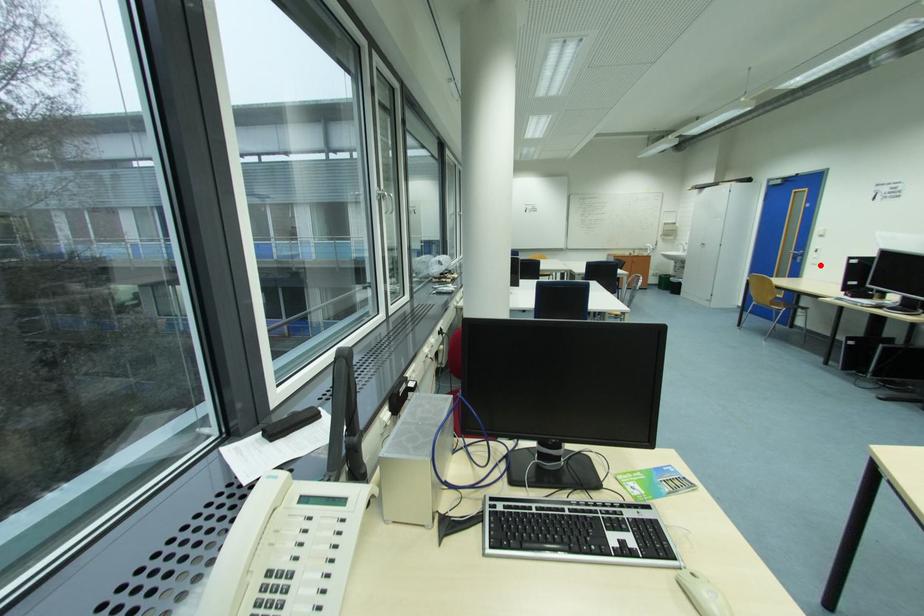
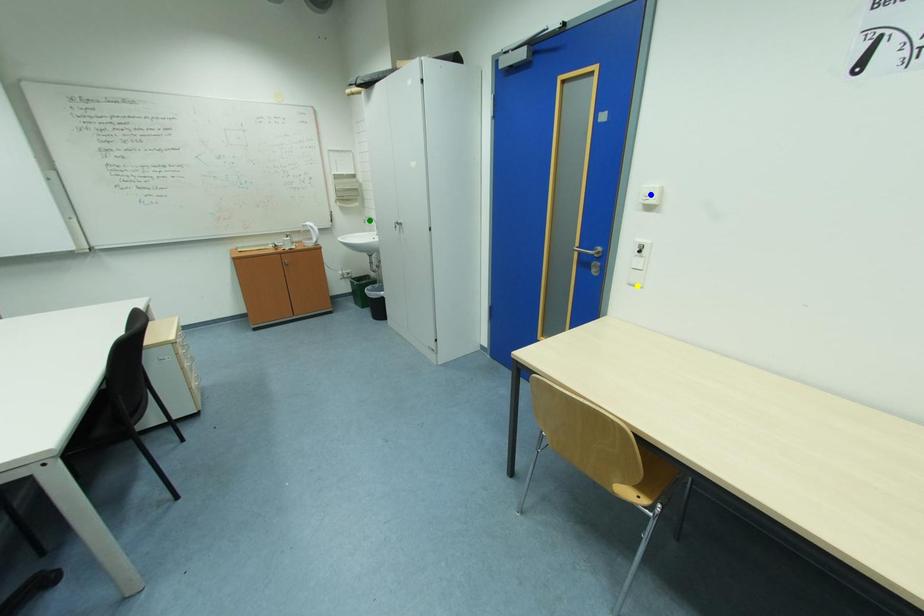
Question: I am providing you with two images of the same scene from different viewpoints. A red point is marked on the first image. You are given multiple points on the second image. Which spot in image 2 lines up with the point in image 1?

Choices:
 (A) blue point
 (B) green point
 (C) yellow point

Answer: (C)